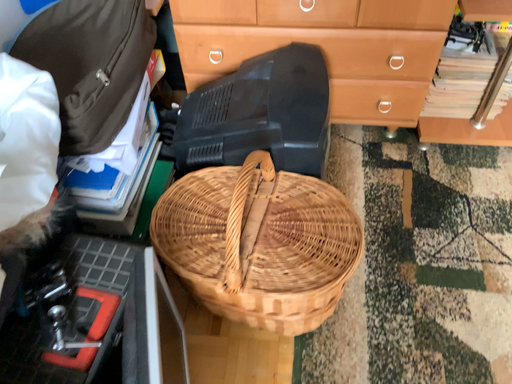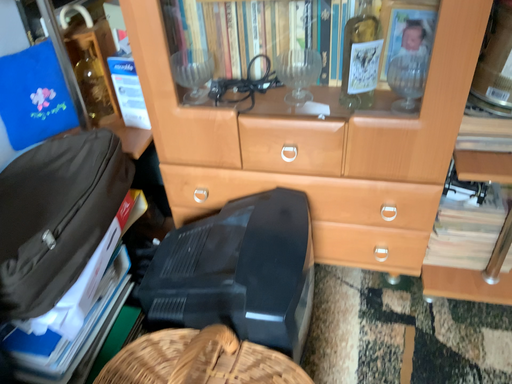
Question: Which way did the camera rotate in the video?

Choices:
 (A) rotated upward
 (B) rotated downward

Answer: (A)